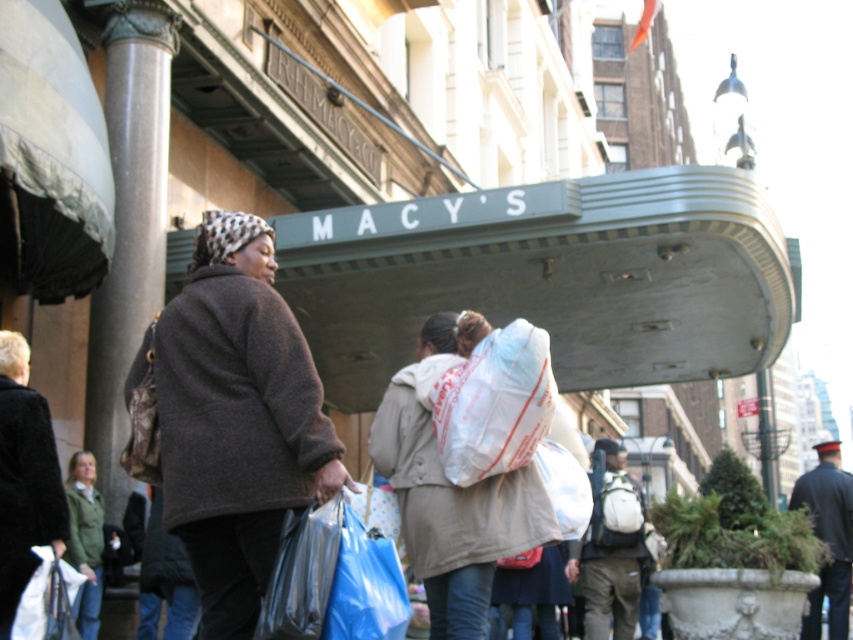
Between matte white backpack at center and blue plastic bag at lower center, which one is positioned lower?

matte white backpack at center is below.

Who is taller, matte white backpack at center or blue plastic bag at lower center?

matte white backpack at center is taller.

Find the location of `matte white backpack at center`. matte white backpack at center is located at coordinates (608, 550).

This screenshot has width=853, height=640. I want to click on matte white backpack at center, so click(608, 550).

Between point (515, 336) and point (41, 588), which one is positioned in front?

Point (41, 588)

Which is more to the left, white plastic bag at center or translucent plastic bag at lower left?

translucent plastic bag at lower left is more to the left.

I want to click on white plastic bag at center, so click(494, 403).

You are a GUI agent. You are given a task and a screenshot of the screen. Output one action in this format:
    pyautogui.click(x=<x>, y=<y>)
    Task: Click on the white plastic bag at center
    
    Given the screenshot: What is the action you would take?
    pyautogui.click(x=494, y=403)

Is point (526, 432) closer to viewer compared to point (325, 502)?

No, it is not.

How distant is white plastic bag at center from shiny plastic bag at lower center?

white plastic bag at center and shiny plastic bag at lower center are 5.56 meters apart.

This screenshot has width=853, height=640. I want to click on white plastic bag at center, so click(494, 403).